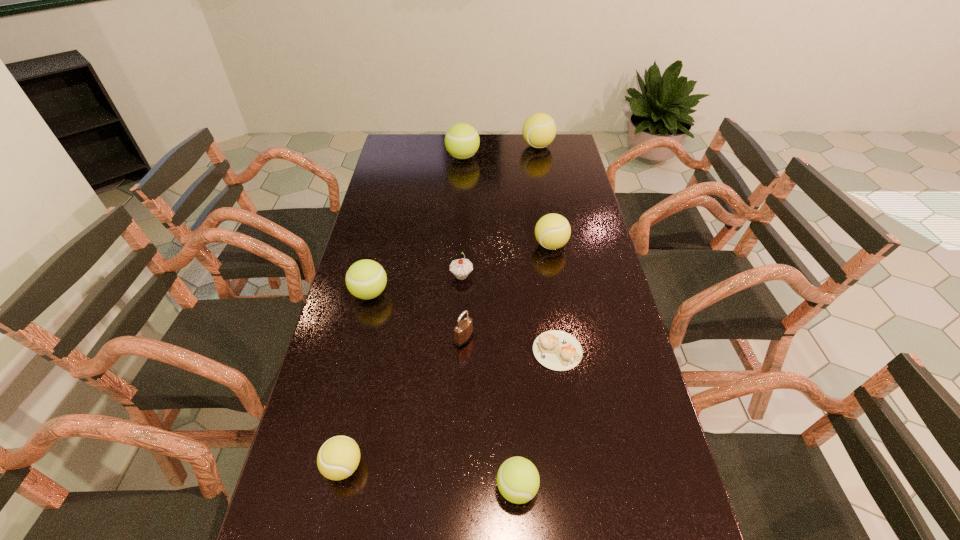
The image size is (960, 540). I want to click on the nearest yellow tennis ball, so click(337, 459).

At what (x,y) coordinates should I click in order to perform the action: click on the rightmost green tennis ball. Please return your answer as a coordinate pair (x, y). Looking at the image, I should click on (518, 480).

Image resolution: width=960 pixels, height=540 pixels. I want to click on the nearest green tennis ball, so click(518, 480).

Image resolution: width=960 pixels, height=540 pixels. In order to click on the shortest object in this screenshot , I will do `click(557, 350)`.

At what (x,y) coordinates should I click in order to perform the action: click on white cappuccino. Please return your answer as a coordinate pair (x, y). Looking at the image, I should click on (557, 350).

Where is `free spot located 0.240m on the front of the biggest yellow tennis ball`? Image resolution: width=960 pixels, height=540 pixels. free spot located 0.240m on the front of the biggest yellow tennis ball is located at coordinates (545, 185).

Find the location of a particular element. Image resolution: width=960 pixels, height=540 pixels. free space located 0.100m on the right of the farthest green tennis ball is located at coordinates (503, 157).

Where is `free point located 0.170m on the left of the second smallest yellow tennis ball`? The image size is (960, 540). free point located 0.170m on the left of the second smallest yellow tennis ball is located at coordinates (484, 245).

You are a GUI agent. You are given a task and a screenshot of the screen. Output one action in this format:
    pyautogui.click(x=<x>, y=<y>)
    Task: Click on the vacant position located 0.400m on the front of the fourth farthest tennis ball
    The height and width of the screenshot is (540, 960).
    Given the screenshot: What is the action you would take?
    pyautogui.click(x=335, y=437)

I want to click on vacant area situated 0.230m on the front of the gray cupcake, so click(x=459, y=344).